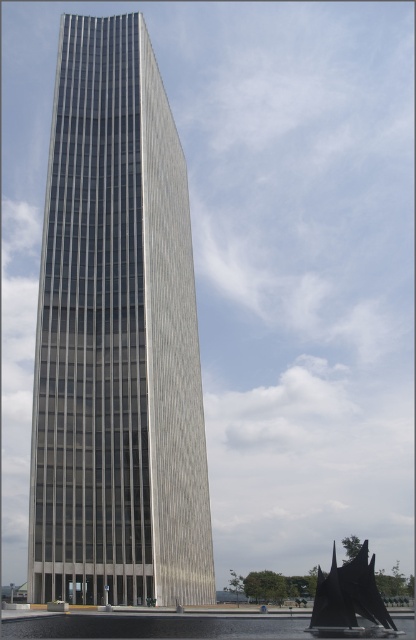
Which of these two, silver glass skyscraper at center or black matte sailboat at lower right, stands taller?

Standing taller between the two is black matte sailboat at lower right.

Can you confirm if silver glass skyscraper at center is smaller than black matte sailboat at lower right?

Yes, silver glass skyscraper at center is smaller than black matte sailboat at lower right.

Where is `silver glass skyscraper at center`? silver glass skyscraper at center is located at coordinates (116, 339).